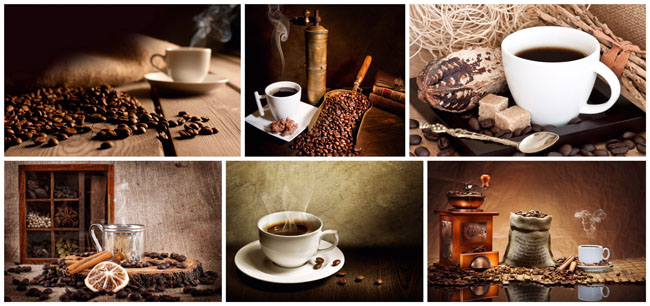
Identify the location of mug. (x=600, y=268), (x=532, y=68), (x=281, y=111), (x=277, y=247), (x=192, y=56), (x=127, y=240).